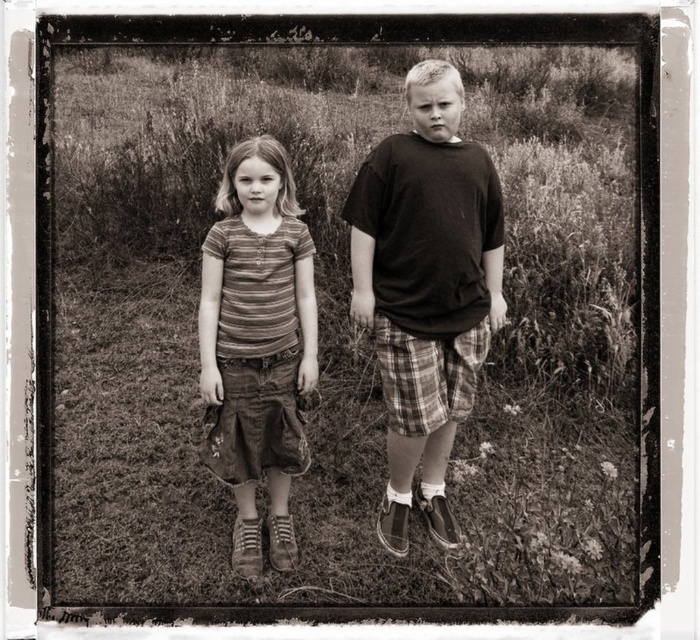
Question: Does dark brown cotton shirt at center have a greater width compared to striped cotton shirt at center?

Choices:
 (A) no
 (B) yes

Answer: (B)

Question: Which point is closer to the camera?

Choices:
 (A) (561, 577)
 (B) (239, 163)

Answer: (A)

Question: Considering the real-world distances, which object is farthest from the dark brown cotton shirt at center?

Choices:
 (A) grassy field at center
 (B) striped cotton shirt at center

Answer: (A)

Question: In this image, where is dark brown cotton shirt at center located relative to striped cotton shirt at center?

Choices:
 (A) left
 (B) right

Answer: (B)

Question: Which of the following is the farthest from the observer?

Choices:
 (A) grassy field at center
 (B) striped cotton shirt at center
 (C) dark brown cotton shirt at center

Answer: (B)

Question: Can you confirm if grassy field at center is bigger than dark brown cotton shirt at center?

Choices:
 (A) yes
 (B) no

Answer: (A)